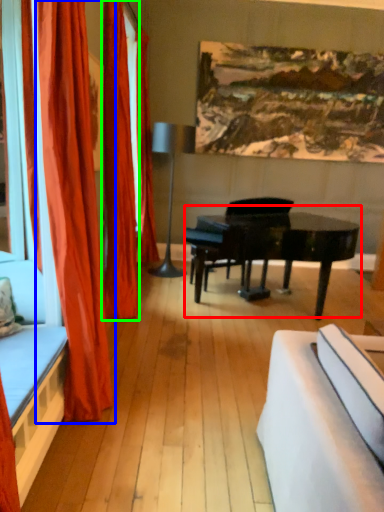
Question: Which is farther away from piano (highlighted by a red box)? curtain (highlighted by a blue box) or curtain (highlighted by a green box)?

Choices:
 (A) curtain
 (B) curtain

Answer: (A)